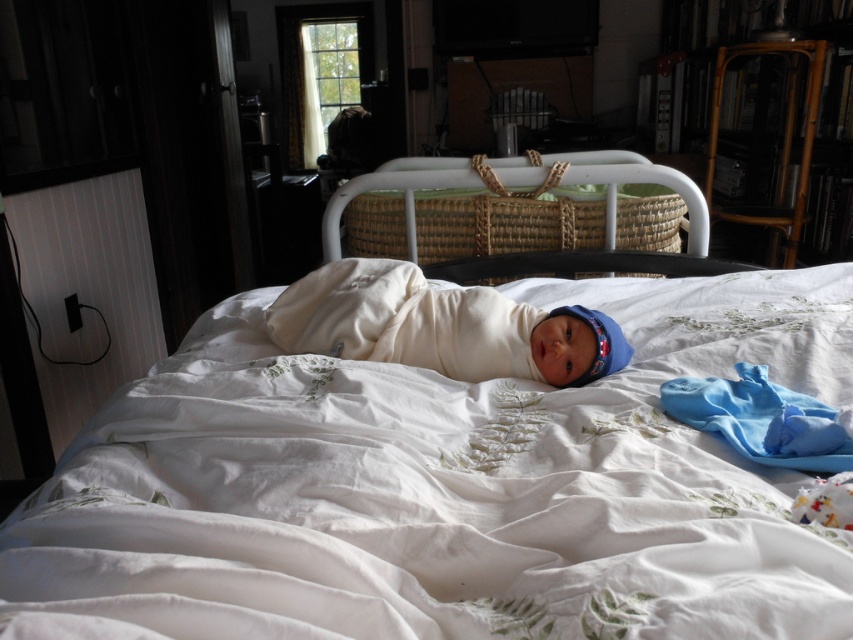
Question: Can you confirm if bamboo bookshelf at upper right is positioned above white soft swaddle at center?

Choices:
 (A) yes
 (B) no

Answer: (A)

Question: Considering the real-world distances, which object is closest to the white embroidered sheet at center?

Choices:
 (A) woven wicker bassinet at center
 (B) white soft swaddle at center

Answer: (B)

Question: Which point is farther to the camera?

Choices:
 (A) white soft swaddle at center
 (B) woven wicker bassinet at center

Answer: (B)

Question: In this image, where is white embroidered sheet at center located relative to woven wicker bassinet at center?

Choices:
 (A) below
 (B) above

Answer: (A)

Question: Is white embroidered sheet at center bigger than woven wicker bassinet at center?

Choices:
 (A) yes
 (B) no

Answer: (A)

Question: Which is farther from the white soft swaddle at center?

Choices:
 (A) bamboo bookshelf at upper right
 (B) woven wicker bassinet at center

Answer: (A)